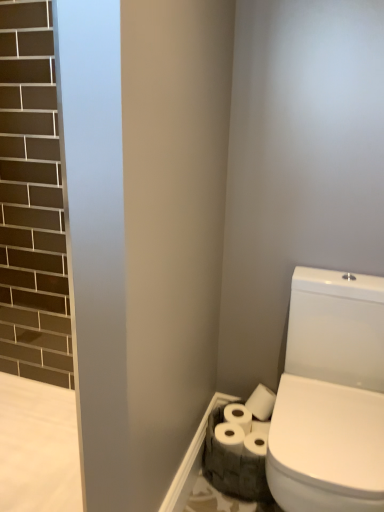
The width and height of the screenshot is (384, 512). Describe the element at coordinates (230, 436) in the screenshot. I see `white matte toilet paper at lower right, the first toilet paper when ordered from front to back` at that location.

The height and width of the screenshot is (512, 384). I want to click on white matte toilet paper at lower right, the first toilet paper when ordered from front to back, so click(230, 436).

How much space does white matte toilet paper at lower right, the first toilet paper when ordered from front to back, occupy vertically?

It is 3.84 inches.

Where is `white matte toilet paper at lower right, the 2th toilet paper positioned from the front`? The width and height of the screenshot is (384, 512). white matte toilet paper at lower right, the 2th toilet paper positioned from the front is located at coordinates (238, 416).

What is the approximate height of white matte toilet paper at lower right, the 2th toilet paper positioned from the front?

white matte toilet paper at lower right, the 2th toilet paper positioned from the front, is 4.32 inches in height.

Describe the element at coordinates (238, 416) in the screenshot. The image size is (384, 512). I see `white matte toilet paper at lower right, the 2th toilet paper positioned from the front` at that location.

Locate an element on the screen. white matte toilet paper at lower right, positioned as the second toilet paper in back-to-front order is located at coordinates (230, 436).

Considering the relative positions of white matte toilet paper at lower right, positioned as the second toilet paper in back-to-front order, and white matte toilet paper at lower right, which is counted as the 1th toilet paper, starting from the back, in the image provided, is white matte toilet paper at lower right, positioned as the second toilet paper in back-to-front order, to the left of white matte toilet paper at lower right, which is counted as the 1th toilet paper, starting from the back, from the viewer's perspective?

Yes, white matte toilet paper at lower right, positioned as the second toilet paper in back-to-front order, is to the left of white matte toilet paper at lower right, which is counted as the 1th toilet paper, starting from the back.

Considering the positions of objects white matte toilet paper at lower right, positioned as the second toilet paper in back-to-front order, and white matte toilet paper at lower right, which is counted as the 1th toilet paper, starting from the back, in the image provided, who is behind, white matte toilet paper at lower right, positioned as the second toilet paper in back-to-front order, or white matte toilet paper at lower right, which is counted as the 1th toilet paper, starting from the back,?

white matte toilet paper at lower right, which is counted as the 1th toilet paper, starting from the back, is more distant.

Considering the positions of points (230, 440) and (233, 420), is point (230, 440) closer to camera compared to point (233, 420)?

Yes, point (230, 440) is closer to viewer.

From the image's perspective, is white matte toilet paper at lower right, positioned as the second toilet paper in back-to-front order, located above white matte toilet paper at lower right, the 2th toilet paper positioned from the front?

No.

From a real-world perspective, is white matte toilet paper at lower right, the first toilet paper when ordered from front to back, beneath white matte toilet paper at lower right, the 2th toilet paper positioned from the front?

Indeed, from a real-world perspective, white matte toilet paper at lower right, the first toilet paper when ordered from front to back, is positioned beneath white matte toilet paper at lower right, the 2th toilet paper positioned from the front.

Considering the relative sizes of white matte toilet paper at lower right, positioned as the second toilet paper in back-to-front order, and white matte toilet paper at lower right, the 2th toilet paper positioned from the front, in the image provided, is white matte toilet paper at lower right, positioned as the second toilet paper in back-to-front order, wider than white matte toilet paper at lower right, the 2th toilet paper positioned from the front,?

Yes, white matte toilet paper at lower right, positioned as the second toilet paper in back-to-front order, is wider than white matte toilet paper at lower right, the 2th toilet paper positioned from the front.

Based on the photo, from their relative heights in the image, would you say white matte toilet paper at lower right, the first toilet paper when ordered from front to back, is taller or shorter than white matte toilet paper at lower right, which is counted as the 1th toilet paper, starting from the back?

white matte toilet paper at lower right, the first toilet paper when ordered from front to back, is shorter than white matte toilet paper at lower right, which is counted as the 1th toilet paper, starting from the back.

Considering the sizes of objects white matte toilet paper at lower right, the first toilet paper when ordered from front to back, and white matte toilet paper at lower right, which is counted as the 1th toilet paper, starting from the back, in the image provided, who is smaller, white matte toilet paper at lower right, the first toilet paper when ordered from front to back, or white matte toilet paper at lower right, which is counted as the 1th toilet paper, starting from the back,?

Smaller between the two is white matte toilet paper at lower right, which is counted as the 1th toilet paper, starting from the back.

Is white matte toilet paper at lower right, the 2th toilet paper positioned from the front, surrounded by white matte toilet paper at lower right, the first toilet paper when ordered from front to back?

No, white matte toilet paper at lower right, the 2th toilet paper positioned from the front, is not a part of white matte toilet paper at lower right, the first toilet paper when ordered from front to back.

Is white matte toilet paper at lower right, the first toilet paper when ordered from front to back, not near white matte toilet paper at lower right, which is counted as the 1th toilet paper, starting from the back?

No, white matte toilet paper at lower right, the first toilet paper when ordered from front to back, is not far away from white matte toilet paper at lower right, which is counted as the 1th toilet paper, starting from the back.

Is white matte toilet paper at lower right, positioned as the second toilet paper in back-to-front order, turned away from white matte toilet paper at lower right, which is counted as the 1th toilet paper, starting from the back?

Yes, white matte toilet paper at lower right, positioned as the second toilet paper in back-to-front order,'s orientation is away from white matte toilet paper at lower right, which is counted as the 1th toilet paper, starting from the back.

What's the angular difference between white matte toilet paper at lower right, the first toilet paper when ordered from front to back, and white matte toilet paper at lower right, the 2th toilet paper positioned from the front,'s facing directions?

0.0056 degrees.

Measure the distance between white matte toilet paper at lower right, positioned as the second toilet paper in back-to-front order, and white matte toilet paper at lower right, which is counted as the 1th toilet paper, starting from the back.

white matte toilet paper at lower right, positioned as the second toilet paper in back-to-front order, is 1.94 inches away from white matte toilet paper at lower right, which is counted as the 1th toilet paper, starting from the back.

Find the location of a particular element. Image resolution: width=384 pixels, height=512 pixels. toilet paper that is above the white matte toilet paper at lower right, positioned as the second toilet paper in back-to-front order (from a real-world perspective) is located at coordinates point(238,416).

Is white matte toilet paper at lower right, which is counted as the 1th toilet paper, starting from the back, to the left or to the right of white matte toilet paper at lower right, the first toilet paper when ordered from front to back, in the image?

In the image, white matte toilet paper at lower right, which is counted as the 1th toilet paper, starting from the back, appears on the right side of white matte toilet paper at lower right, the first toilet paper when ordered from front to back.

Based on the photo, which is in front, white matte toilet paper at lower right, which is counted as the 1th toilet paper, starting from the back, or white matte toilet paper at lower right, the first toilet paper when ordered from front to back?

white matte toilet paper at lower right, the first toilet paper when ordered from front to back, is closer to the camera.

Does point (244, 422) come farther from viewer compared to point (225, 426)?

Yes, it is behind point (225, 426).

From the image's perspective, which one is positioned higher, white matte toilet paper at lower right, which is counted as the 1th toilet paper, starting from the back, or white matte toilet paper at lower right, the first toilet paper when ordered from front to back?

From the image's view, white matte toilet paper at lower right, which is counted as the 1th toilet paper, starting from the back, is above.

From a real-world perspective, is white matte toilet paper at lower right, which is counted as the 1th toilet paper, starting from the back, positioned above or below white matte toilet paper at lower right, the first toilet paper when ordered from front to back?

In terms of real-world spatial position, white matte toilet paper at lower right, which is counted as the 1th toilet paper, starting from the back, is above white matte toilet paper at lower right, the first toilet paper when ordered from front to back.

Which object is thinner, white matte toilet paper at lower right, the 2th toilet paper positioned from the front, or white matte toilet paper at lower right, the first toilet paper when ordered from front to back?

Thinner between the two is white matte toilet paper at lower right, the 2th toilet paper positioned from the front.

From their relative heights in the image, would you say white matte toilet paper at lower right, the 2th toilet paper positioned from the front, is taller or shorter than white matte toilet paper at lower right, the first toilet paper when ordered from front to back?

Considering their sizes, white matte toilet paper at lower right, the 2th toilet paper positioned from the front, has more height than white matte toilet paper at lower right, the first toilet paper when ordered from front to back.

Considering the sizes of objects white matte toilet paper at lower right, the 2th toilet paper positioned from the front, and white matte toilet paper at lower right, the first toilet paper when ordered from front to back, in the image provided, who is smaller, white matte toilet paper at lower right, the 2th toilet paper positioned from the front, or white matte toilet paper at lower right, the first toilet paper when ordered from front to back,?

Smaller between the two is white matte toilet paper at lower right, the 2th toilet paper positioned from the front.

Would you say white matte toilet paper at lower right, which is counted as the 1th toilet paper, starting from the back, is outside white matte toilet paper at lower right, the first toilet paper when ordered from front to back?

Yes, white matte toilet paper at lower right, which is counted as the 1th toilet paper, starting from the back, is located beyond the bounds of white matte toilet paper at lower right, the first toilet paper when ordered from front to back.

Are white matte toilet paper at lower right, the 2th toilet paper positioned from the front, and white matte toilet paper at lower right, the first toilet paper when ordered from front to back, far apart?

No, white matte toilet paper at lower right, the 2th toilet paper positioned from the front, is not far away from white matte toilet paper at lower right, the first toilet paper when ordered from front to back.

Is white matte toilet paper at lower right, the 2th toilet paper positioned from the front, aimed at white matte toilet paper at lower right, positioned as the second toilet paper in back-to-front order?

Yes, white matte toilet paper at lower right, the 2th toilet paper positioned from the front, faces towards white matte toilet paper at lower right, positioned as the second toilet paper in back-to-front order.

How different are the orientations of white matte toilet paper at lower right, which is counted as the 1th toilet paper, starting from the back, and white matte toilet paper at lower right, positioned as the second toilet paper in back-to-front order, in degrees?

There is a 0.0056-degree angle between the facing directions of white matte toilet paper at lower right, which is counted as the 1th toilet paper, starting from the back, and white matte toilet paper at lower right, positioned as the second toilet paper in back-to-front order.

Identify the location of toilet paper that is below the white matte toilet paper at lower right, the 2th toilet paper positioned from the front (from the image's perspective). The width and height of the screenshot is (384, 512). (230, 436).

Identify the location of toilet paper on the left side of white matte toilet paper at lower right, the 2th toilet paper positioned from the front. (230, 436).

The height and width of the screenshot is (512, 384). What are the coordinates of `toilet paper above the white matte toilet paper at lower right, the first toilet paper when ordered from front to back (from a real-world perspective)` in the screenshot? It's located at (238, 416).